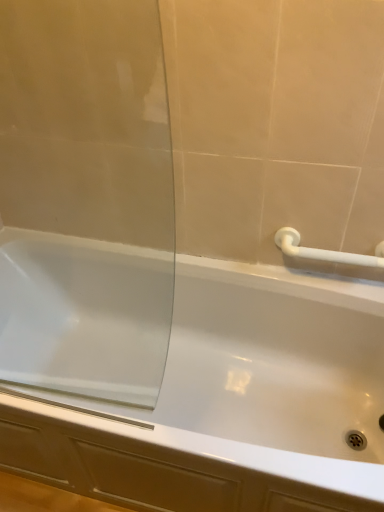
Question: Does white glossy bathtub at center lie in front of transparent glass screen door at left?

Choices:
 (A) no
 (B) yes

Answer: (A)

Question: Can you confirm if white glossy bathtub at center is positioned to the right of transparent glass screen door at left?

Choices:
 (A) yes
 (B) no

Answer: (A)

Question: Is transparent glass screen door at left surrounded by white glossy bathtub at center?

Choices:
 (A) no
 (B) yes

Answer: (A)

Question: Does white glossy bathtub at center have a smaller size compared to transparent glass screen door at left?

Choices:
 (A) no
 (B) yes

Answer: (A)

Question: From the image's perspective, does white glossy bathtub at center appear lower than transparent glass screen door at left?

Choices:
 (A) yes
 (B) no

Answer: (A)

Question: From the image's perspective, is white glossy bathtub at center above transparent glass screen door at left?

Choices:
 (A) yes
 (B) no

Answer: (B)

Question: Would you consider white plastic towel bar at upper right to be distant from transparent glass screen door at left?

Choices:
 (A) no
 (B) yes

Answer: (A)

Question: Is transparent glass screen door at left surrounded by white plastic towel bar at upper right?

Choices:
 (A) no
 (B) yes

Answer: (A)

Question: Considering the relative sizes of white plastic towel bar at upper right and transparent glass screen door at left in the image provided, is white plastic towel bar at upper right shorter than transparent glass screen door at left?

Choices:
 (A) yes
 (B) no

Answer: (A)

Question: Can you confirm if white plastic towel bar at upper right is smaller than transparent glass screen door at left?

Choices:
 (A) no
 (B) yes

Answer: (B)

Question: Is white plastic towel bar at upper right wider than transparent glass screen door at left?

Choices:
 (A) no
 (B) yes

Answer: (B)

Question: Is white plastic towel bar at upper right aimed at transparent glass screen door at left?

Choices:
 (A) no
 (B) yes

Answer: (A)

Question: From the image's perspective, is transparent glass screen door at left under white glossy bathtub at center?

Choices:
 (A) no
 (B) yes

Answer: (A)